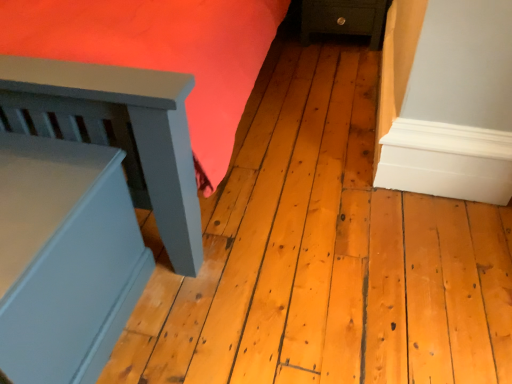
Question: Based on their sizes in the image, would you say matte blue bed frame at left, the first furniture in the front-to-back sequence, is bigger or smaller than dark green wood nightstand at lower right, arranged as the first furniture when viewed from the back?

Choices:
 (A) big
 (B) small

Answer: (A)

Question: Would you say matte blue bed frame at left, arranged as the first furniture when ordered from the bottom, is to the left or to the right of dark green wood nightstand at lower right, which appears as the 2th furniture when viewed from the left, in the picture?

Choices:
 (A) right
 (B) left

Answer: (B)

Question: Is matte blue bed frame at left, arranged as the first furniture when ordered from the bottom, situated inside dark green wood nightstand at lower right, arranged as the first furniture when viewed from the back, or outside?

Choices:
 (A) outside
 (B) inside

Answer: (A)

Question: From a real-world perspective, is dark green wood nightstand at lower right, which appears as the 2th furniture when viewed from the left, physically located above or below matte blue bed frame at left, arranged as the first furniture when ordered from the bottom?

Choices:
 (A) below
 (B) above

Answer: (A)

Question: In terms of size, does dark green wood nightstand at lower right, marked as the second furniture in a bottom-to-top arrangement, appear bigger or smaller than matte blue bed frame at left, the 2th furniture from the back?

Choices:
 (A) small
 (B) big

Answer: (A)

Question: Considering the positions of point (314, 18) and point (139, 291), is point (314, 18) closer or farther from the camera than point (139, 291)?

Choices:
 (A) farther
 (B) closer

Answer: (A)

Question: Is dark green wood nightstand at lower right, the first furniture when ordered from top to bottom, in front of or behind matte blue bed frame at left, the second furniture positioned from the right, in the image?

Choices:
 (A) front
 (B) behind

Answer: (B)